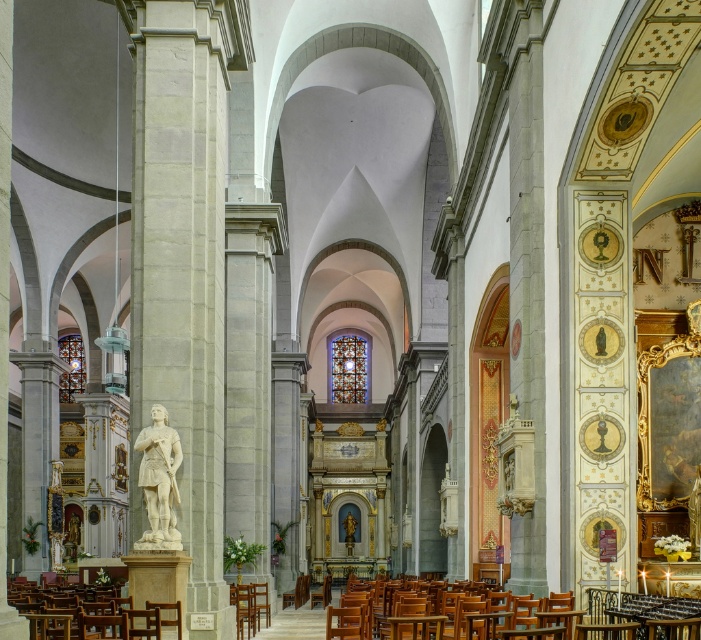
Who is more forward, (210, 614) or (683, 611)?

Point (683, 611)

Does white marble statue at left come in front of wooden polished chair at center?

That is False.

What are the coordinates of `white marble statue at left` in the screenshot? It's located at (184, 257).

Is white marble statue at left taller than wooden polished chair at lower left?

Indeed, white marble statue at left has a greater height compared to wooden polished chair at lower left.

Does white marble statue at left have a greater width compared to wooden polished chair at lower left?

In fact, white marble statue at left might be narrower than wooden polished chair at lower left.

Is point (149, 243) closer to camera compared to point (79, 636)?

No, it is not.

Where is `white marble statue at left`? The width and height of the screenshot is (701, 640). white marble statue at left is located at coordinates (184, 257).

Can you confirm if white marble statue at left is taller than white marble statue at center?

Indeed, white marble statue at left has a greater height compared to white marble statue at center.

Who is lower down, white marble statue at left or white marble statue at center?

white marble statue at center

What do you see at coordinates (184, 257) in the screenshot?
I see `white marble statue at left` at bounding box center [184, 257].

In order to click on white marble statue at left in this screenshot , I will do coord(184,257).